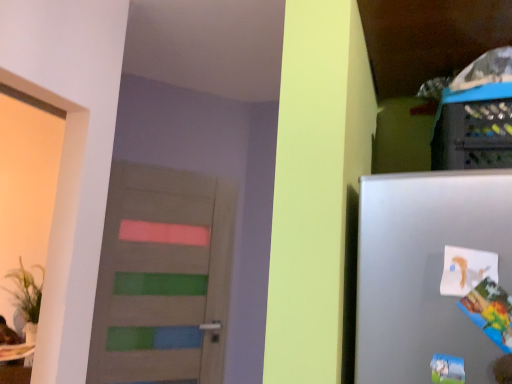
Question: Is point (209, 264) positioned closer to the camera than point (509, 302)?

Choices:
 (A) farther
 (B) closer

Answer: (A)

Question: Considering the positions of wooden door with painted stripes at center and colorful paper comic book at right in the image, is wooden door with painted stripes at center wider or thinner than colorful paper comic book at right?

Choices:
 (A) thin
 (B) wide

Answer: (A)

Question: In the image, is wooden door with painted stripes at center on the left side or the right side of colorful paper comic book at right?

Choices:
 (A) left
 (B) right

Answer: (A)

Question: Does point (478, 324) appear closer or farther from the camera than point (111, 175)?

Choices:
 (A) closer
 (B) farther

Answer: (A)

Question: In terms of height, does colorful paper comic book at right look taller or shorter compared to wooden door with painted stripes at center?

Choices:
 (A) tall
 (B) short

Answer: (B)

Question: Would you say colorful paper comic book at right is inside or outside wooden door with painted stripes at center?

Choices:
 (A) outside
 (B) inside

Answer: (A)

Question: From the image's perspective, relative to wooden door with painted stripes at center, is colorful paper comic book at right above or below?

Choices:
 (A) above
 (B) below

Answer: (A)